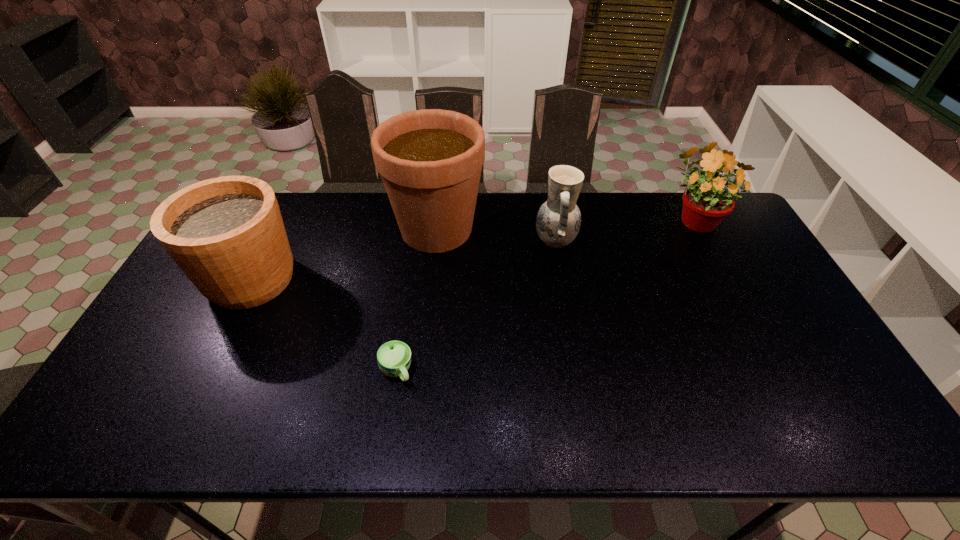
Where is `object that can be found as the fourth closest to the leftmost object`? This screenshot has width=960, height=540. object that can be found as the fourth closest to the leftmost object is located at coordinates (705, 205).

Identify which flowerpot is the nearest to the pottery. Please provide its 2D coordinates. Your answer should be formatted as a tuple, i.e. [(x, y)], where the tuple contains the x and y coordinates of a point satisfying the conditions above.

[(430, 160)]

Choose which flowerpot is the second nearest neighbor to the leftmost object. Please provide its 2D coordinates. Your answer should be formatted as a tuple, i.e. [(x, y)], where the tuple contains the x and y coordinates of a point satisfying the conditions above.

[(705, 205)]

At what (x,y) coordinates should I click in order to perform the action: click on free spot that satisfies the following two spatial constraints: 1. on the back side of the nearest object; 2. on the left side of the rightmost object. Please return your answer as a coordinate pair (x, y). The image size is (960, 540). Looking at the image, I should click on (420, 218).

Find the location of a particular element. This screenshot has width=960, height=540. vacant space that satisfies the following two spatial constraints: 1. on the back side of the nearest object; 2. on the right side of the second flowerpot from left to right is located at coordinates (418, 229).